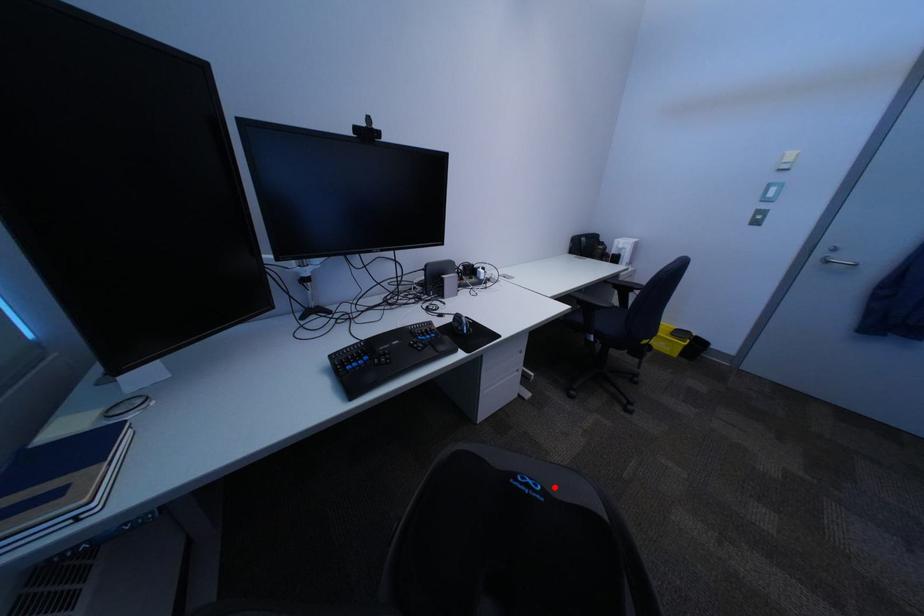
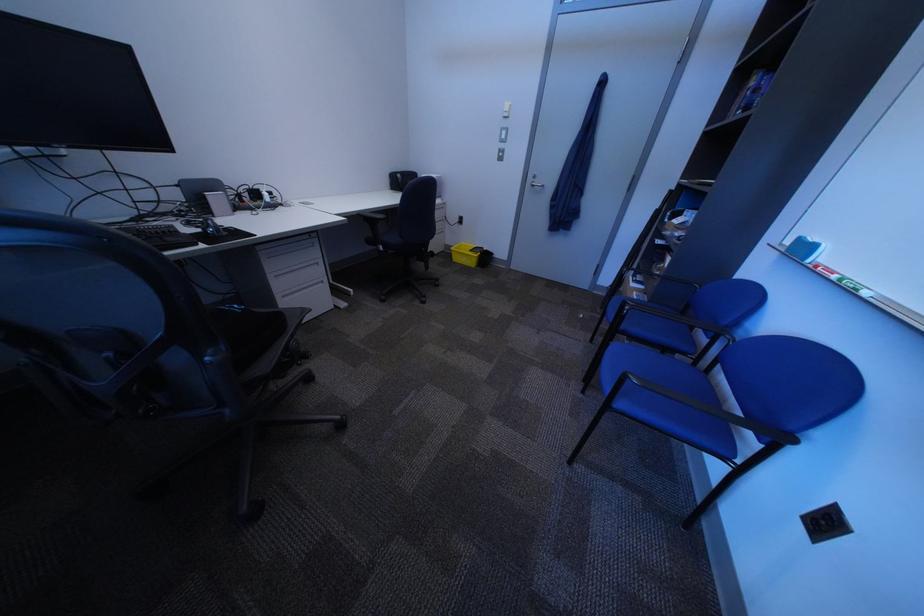
Question: I am providing you with two images of the same scene from different viewpoints. Given a red point in image1, look at the same physical point in image2. Is it:

Choices:
 (A) Closer to the viewpoint
 (B) Farther from the viewpoint

Answer: (B)